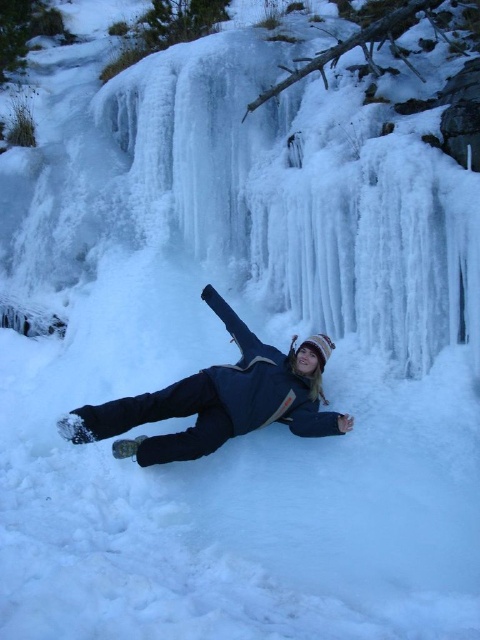
Question: Which point is closer to the camera?

Choices:
 (A) blue fabric person at center
 (B) icy translucent waterfall at upper center

Answer: (A)

Question: Which of the following is the closest to the observer?

Choices:
 (A) blue fabric person at center
 (B) icy translucent waterfall at upper center

Answer: (A)

Question: Is the position of icy translucent waterfall at upper center less distant than that of blue fabric person at center?

Choices:
 (A) no
 (B) yes

Answer: (A)

Question: Is icy translucent waterfall at upper center to the left of blue fabric person at center from the viewer's perspective?

Choices:
 (A) yes
 (B) no

Answer: (B)

Question: Can you confirm if icy translucent waterfall at upper center is positioned to the left of blue fabric person at center?

Choices:
 (A) no
 (B) yes

Answer: (A)